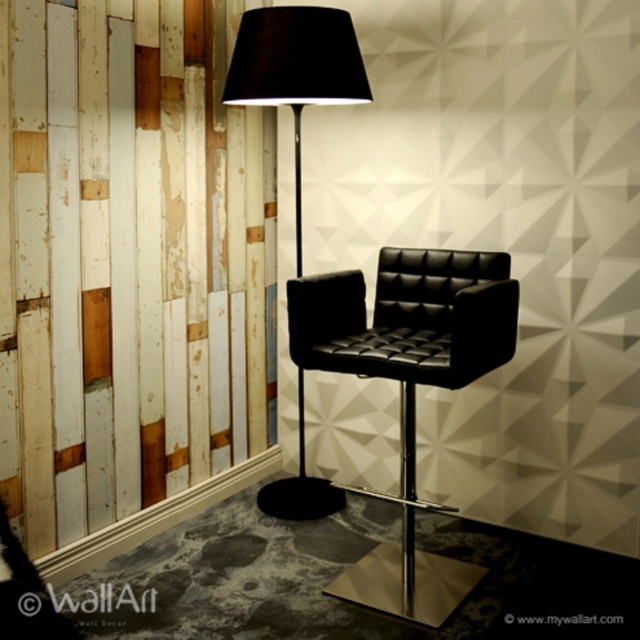
Based on the photo, you are sitting in the black leather armchair at center and want to turn on the black matte floor lamp at center. Which direction should you reach to operate the lamp?

The black leather armchair at center is located below the black matte floor lamp at center, so you should reach upwards to operate the lamp.